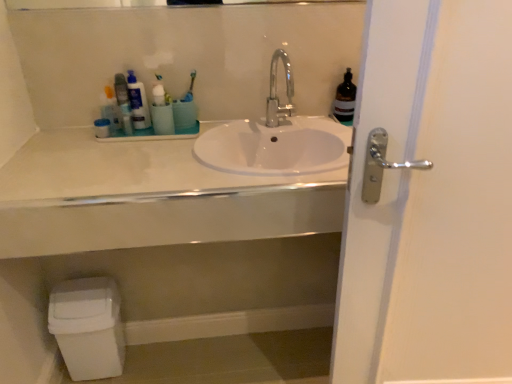
Question: Is white glossy sink at center shorter than white plastic toilet bowl at lower left?

Choices:
 (A) yes
 (B) no

Answer: (A)

Question: Is white glossy sink at center wider than white plastic toilet bowl at lower left?

Choices:
 (A) yes
 (B) no

Answer: (A)

Question: Is white glossy sink at center surrounding white plastic toilet bowl at lower left?

Choices:
 (A) yes
 (B) no

Answer: (B)

Question: From the image's perspective, is white glossy sink at center under white plastic toilet bowl at lower left?

Choices:
 (A) no
 (B) yes

Answer: (A)

Question: Are white glossy sink at center and white plastic toilet bowl at lower left far apart?

Choices:
 (A) yes
 (B) no

Answer: (B)

Question: From a real-world perspective, relative to white glossy sink at center, is translucent plastic bottle at upper left, which is counted as the third toiletry, starting from the left, vertically above or below?

Choices:
 (A) above
 (B) below

Answer: (A)

Question: From the image's perspective, is translucent plastic bottle at upper left, which is counted as the third toiletry, starting from the left, above or below white glossy sink at center?

Choices:
 (A) below
 (B) above

Answer: (B)

Question: Do you think translucent plastic bottle at upper left, which is counted as the third toiletry, starting from the left, is within white glossy sink at center, or outside of it?

Choices:
 (A) inside
 (B) outside

Answer: (B)

Question: From their relative heights in the image, would you say translucent plastic bottle at upper left, which is counted as the third toiletry, starting from the left, is taller or shorter than white glossy sink at center?

Choices:
 (A) short
 (B) tall

Answer: (B)

Question: From the image's perspective, is matte plastic container at upper left, placed as the 3th toiletry when sorted from right to left, positioned above or below blue plastic toothbrush at upper center?

Choices:
 (A) above
 (B) below

Answer: (B)

Question: Based on their sizes in the image, would you say matte plastic container at upper left, placed as the 3th toiletry when sorted from right to left, is bigger or smaller than blue plastic toothbrush at upper center?

Choices:
 (A) big
 (B) small

Answer: (A)

Question: From their relative heights in the image, would you say matte plastic container at upper left, placed as the 3th toiletry when sorted from right to left, is taller or shorter than blue plastic toothbrush at upper center?

Choices:
 (A) tall
 (B) short

Answer: (A)

Question: Considering the positions of point (100, 110) and point (185, 99), is point (100, 110) closer or farther from the camera than point (185, 99)?

Choices:
 (A) farther
 (B) closer

Answer: (A)

Question: From the image's perspective, relative to white plastic toilet bowl at lower left, is blue plastic toothbrush at upper center above or below?

Choices:
 (A) above
 (B) below

Answer: (A)

Question: In terms of size, does blue plastic toothbrush at upper center appear bigger or smaller than white plastic toilet bowl at lower left?

Choices:
 (A) small
 (B) big

Answer: (A)